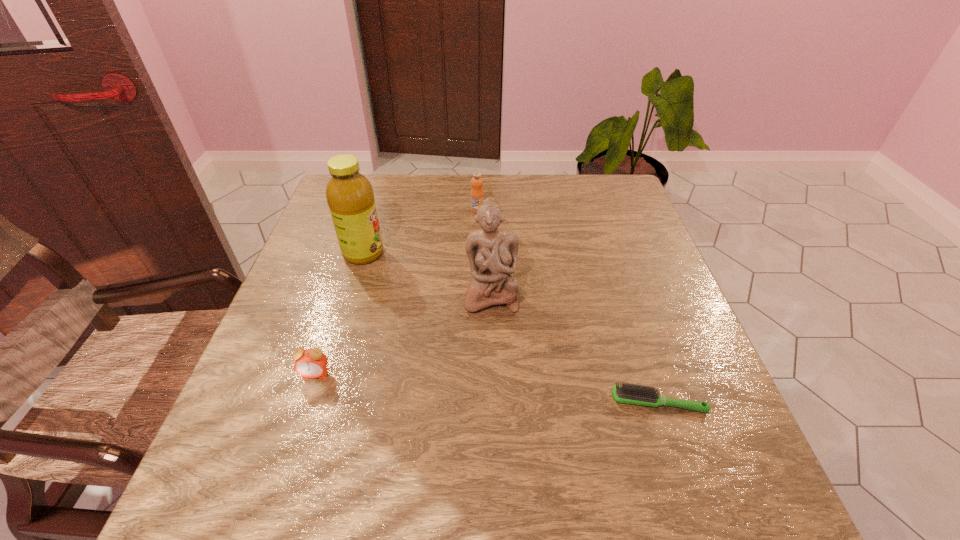
This screenshot has width=960, height=540. I want to click on vacant point at the right edge, so click(x=732, y=445).

Find the location of `free spot at the far right corner of the desktop`. free spot at the far right corner of the desktop is located at coordinates (606, 200).

Where is `free spot between the fourth nearest object and the third farthest object`? The height and width of the screenshot is (540, 960). free spot between the fourth nearest object and the third farthest object is located at coordinates (427, 274).

This screenshot has width=960, height=540. In order to click on unoccupied area between the alarm clock and the fourth nearest object in this screenshot , I will do `click(340, 314)`.

This screenshot has width=960, height=540. In order to click on vacant area between the fourth farthest object and the figurine in this screenshot , I will do `click(403, 335)`.

You are a GUI agent. You are given a task and a screenshot of the screen. Output one action in this format:
    pyautogui.click(x=<x>, y=<y>)
    Task: Click on the free spot between the hairbrush and the second farthest object
    
    Given the screenshot: What is the action you would take?
    pyautogui.click(x=511, y=328)

At what (x,y) coordinates should I click in order to perform the action: click on free space between the hairbrush and the farthest object. Please return your answer as a coordinate pair (x, y). Image resolution: width=960 pixels, height=540 pixels. Looking at the image, I should click on 567,306.

Locate an element on the screen. free space between the farthest object and the fourth nearest object is located at coordinates (420, 232).

Where is `free space between the third shortest object and the alarm clock`? free space between the third shortest object and the alarm clock is located at coordinates (396, 292).

Where is `empty space that is in between the third farthest object and the shortest object`? This screenshot has height=540, width=960. empty space that is in between the third farthest object and the shortest object is located at coordinates (574, 348).